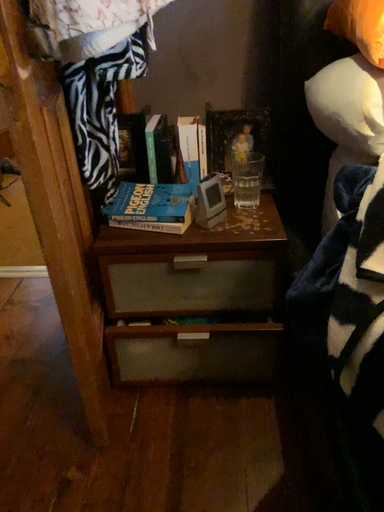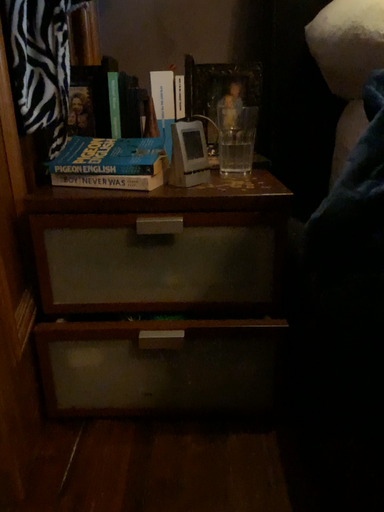
Question: How did the camera likely rotate when shooting the video?

Choices:
 (A) rotated upward
 (B) rotated downward

Answer: (A)